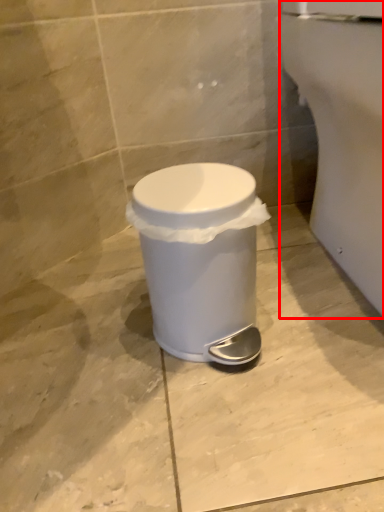
Question: From the image, what is the correct spatial relationship of porcelain (annotated by the red box) in relation to waste container?

Choices:
 (A) left
 (B) right

Answer: (B)